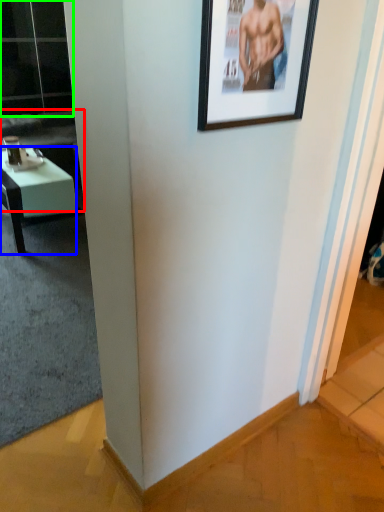
Question: Which is farther away from couch (highlighted by a red box)? desk (highlighted by a blue box) or glass door (highlighted by a green box)?

Choices:
 (A) desk
 (B) glass door

Answer: (A)